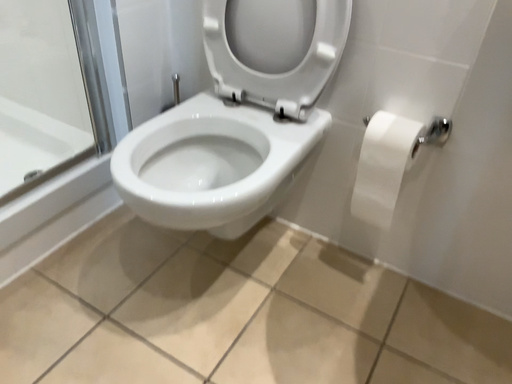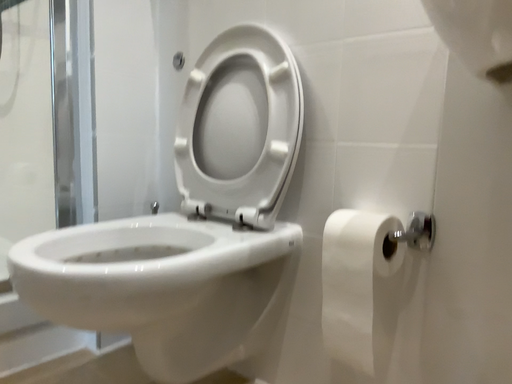
Question: How did the camera likely rotate when shooting the video?

Choices:
 (A) rotated left
 (B) rotated right

Answer: (A)